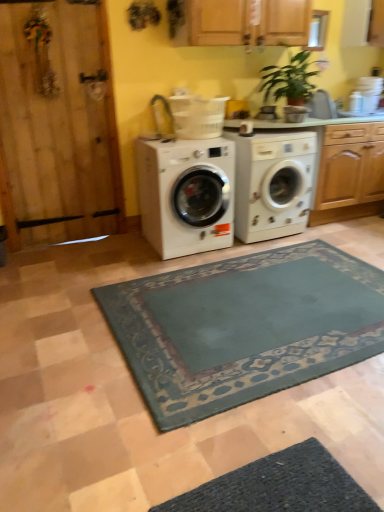
Question: Considering the relative positions of white glossy washing machine at center, which is the second washing machine from left to right, and white glossy washing machine at center, which ranks as the 2th washing machine in right-to-left order, in the image provided, is white glossy washing machine at center, which is the second washing machine from left to right, to the left or to the right of white glossy washing machine at center, which ranks as the 2th washing machine in right-to-left order,?

Choices:
 (A) left
 (B) right

Answer: (B)

Question: From the image's perspective, is white glossy washing machine at center, the first washing machine from the right, positioned above or below white glossy washing machine at center, placed as the first washing machine when sorted from left to right?

Choices:
 (A) above
 (B) below

Answer: (A)

Question: From a real-world perspective, is white glossy washing machine at center, which is the second washing machine from left to right, physically located above or below white glossy washing machine at center, placed as the first washing machine when sorted from left to right?

Choices:
 (A) above
 (B) below

Answer: (B)

Question: In terms of height, does white glossy washing machine at center, placed as the first washing machine when sorted from left to right, look taller or shorter compared to white glossy washing machine at center, the first washing machine from the right?

Choices:
 (A) short
 (B) tall

Answer: (A)

Question: From the image's perspective, is white glossy washing machine at center, which ranks as the 2th washing machine in right-to-left order, located above or below white glossy washing machine at center, the first washing machine from the right?

Choices:
 (A) below
 (B) above

Answer: (A)

Question: From a real-world perspective, relative to white glossy washing machine at center, which is the second washing machine from left to right, is white glossy washing machine at center, which ranks as the 2th washing machine in right-to-left order, vertically above or below?

Choices:
 (A) below
 (B) above

Answer: (B)

Question: In the image, is white glossy washing machine at center, placed as the first washing machine when sorted from left to right, on the left side or the right side of white glossy washing machine at center, the first washing machine from the right?

Choices:
 (A) right
 (B) left

Answer: (B)